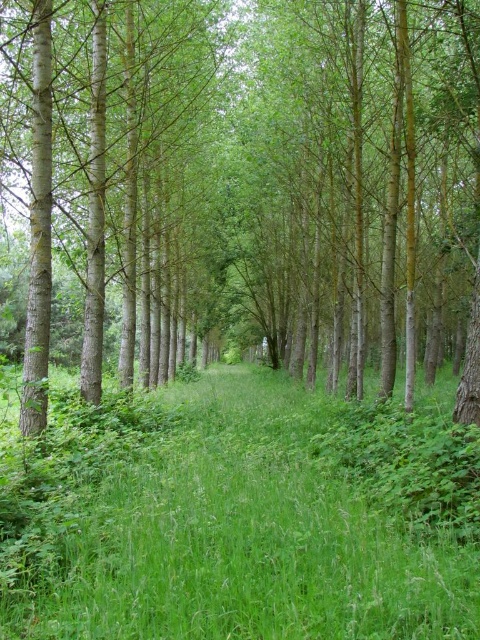
You are standing at the edge of the forest and notice the green smooth tree at center and the green grassy at center. How far apart are these two features from each other?

The green smooth tree at center is 18.55 feet away from the green grassy at center.

You are standing in the forest scene and want to place a small garden gnome exactly at the center of the image. Since there are two objects at the center, the green smooth tree at center and the green grassy at center, which one should you place the gnome on top of?

The green grassy at center is located below the green smooth tree at center, so you should place the gnome on top of the green grassy at center.

You are a hiker who wants to take a photo of the green grassy at center and the green smooth tree at center. Which object should you focus on first if you want to capture both in the same frame without moving the camera?

The green smooth tree at center is larger in size than the green grassy at center, so you should focus on the green smooth tree at center first to ensure it fits within the frame.